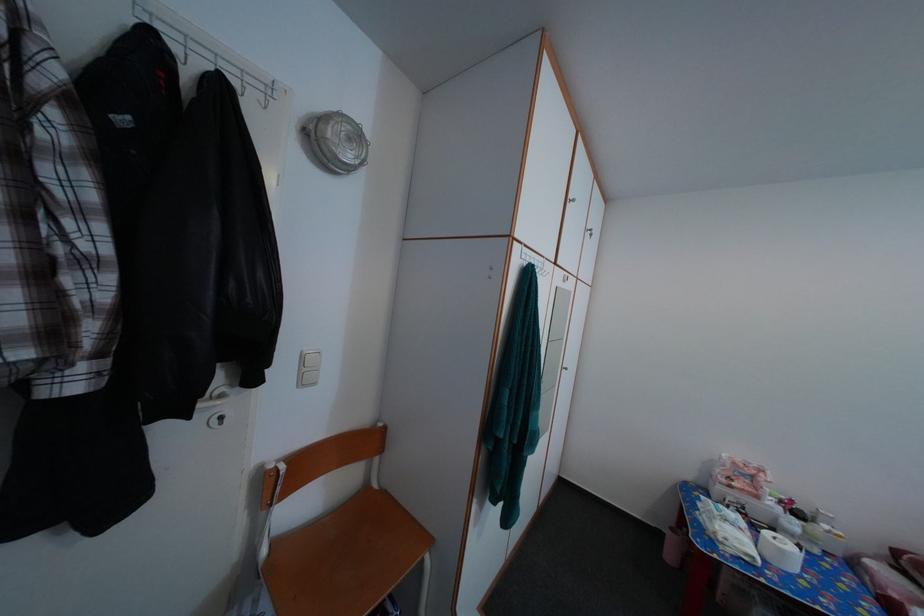
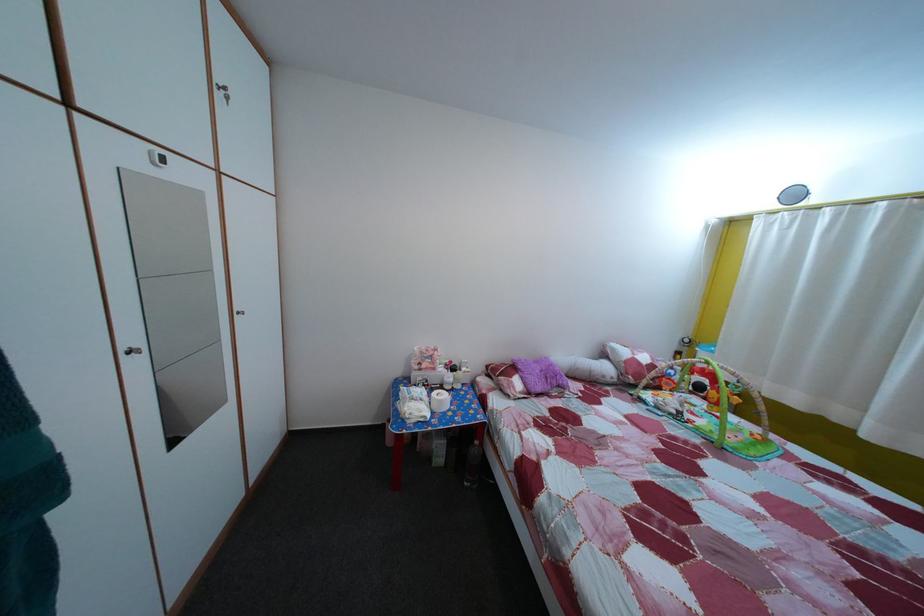
In the scene shown: The images are taken continuously from a first-person perspective. In which direction is your viewpoint rotating?

The rotation direction of the camera is right-down.